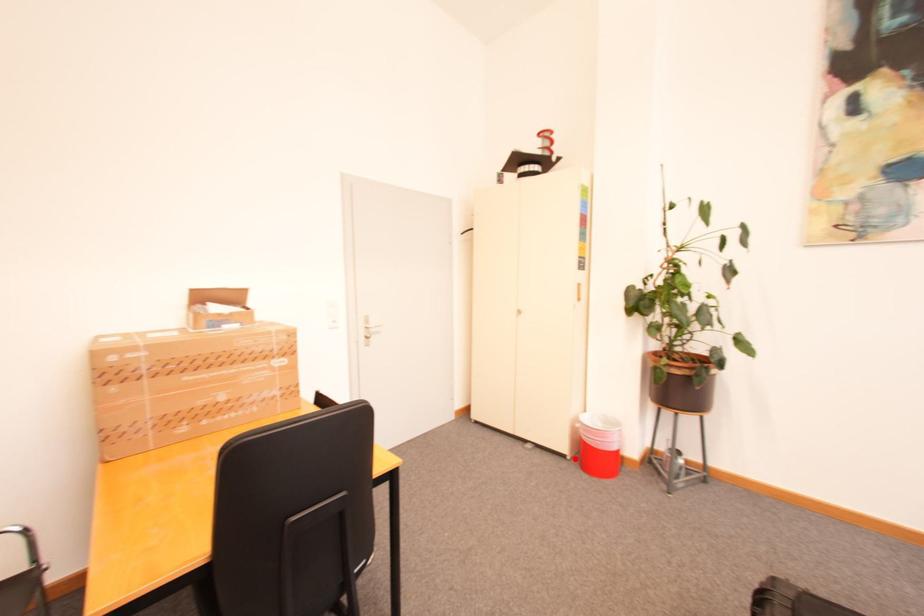
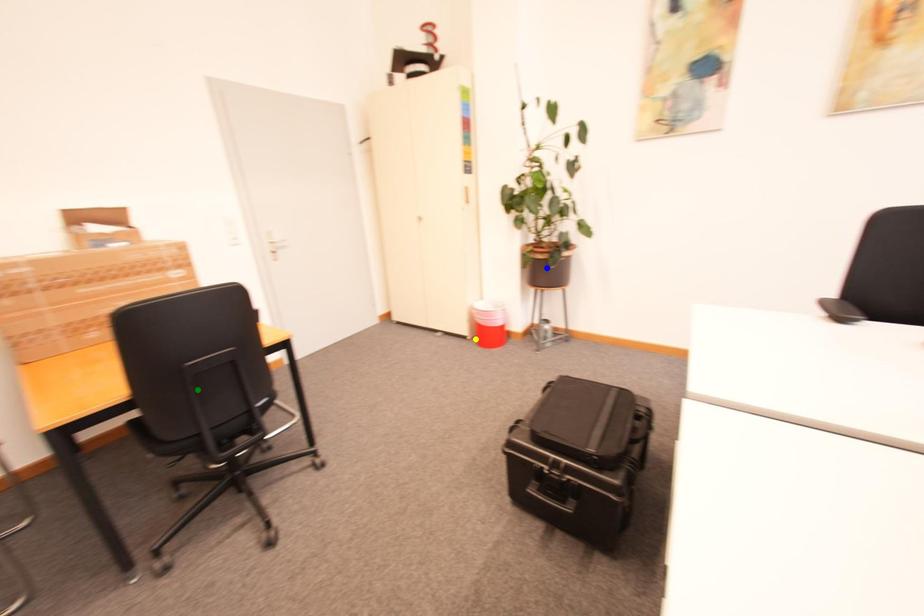
Question: I am providing you with two images of the same scene from different viewpoints. A red point is marked on the first image. You are given multiple points on the second image. Which spot in image 2 lines up with the point in image 1?

Choices:
 (A) blue point
 (B) yellow point
 (C) green point

Answer: (B)